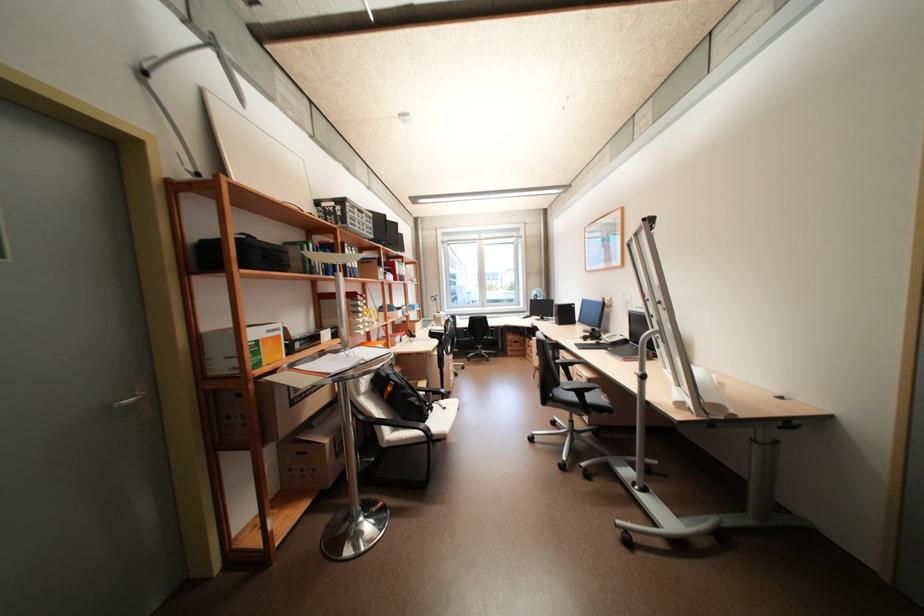
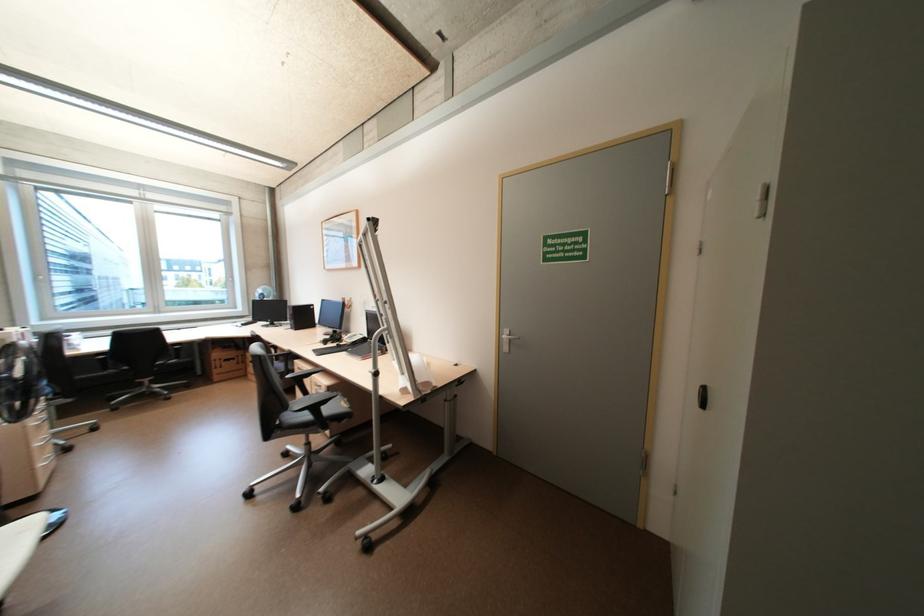
Question: The camera is either moving clockwise (left) or counter-clockwise (right) around the object. The first image is from the beginning of the video and the second image is from the end. Is the camera moving left or right when shooting the video?

Choices:
 (A) Left
 (B) Right

Answer: (A)